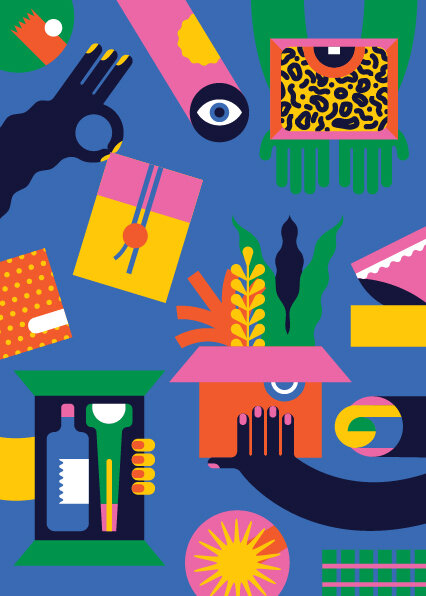
Locate an element on the screen. yellow plant is located at coordinates (246, 254).